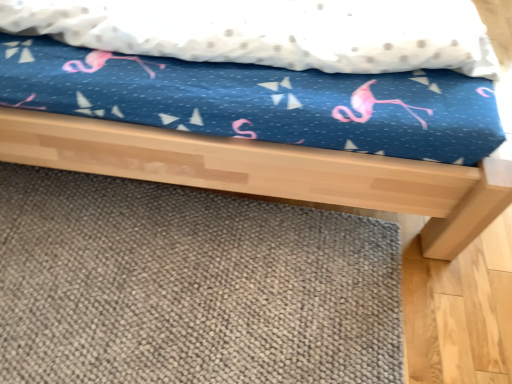
Question: Is gray textured mat at lower center at the left side of blue fabric bed at center?

Choices:
 (A) no
 (B) yes

Answer: (A)

Question: Is gray textured mat at lower center taller than blue fabric bed at center?

Choices:
 (A) yes
 (B) no

Answer: (B)

Question: Does gray textured mat at lower center contain blue fabric bed at center?

Choices:
 (A) yes
 (B) no

Answer: (B)

Question: From the image's perspective, is gray textured mat at lower center located beneath blue fabric bed at center?

Choices:
 (A) no
 (B) yes

Answer: (B)

Question: Is gray textured mat at lower center not inside blue fabric bed at center?

Choices:
 (A) yes
 (B) no

Answer: (A)

Question: Can you confirm if gray textured mat at lower center is thinner than blue fabric bed at center?

Choices:
 (A) yes
 (B) no

Answer: (A)

Question: From the image's perspective, does blue fabric bed at center appear higher than gray textured mat at lower center?

Choices:
 (A) yes
 (B) no

Answer: (A)

Question: Is the depth of blue fabric bed at center less than that of gray textured mat at lower center?

Choices:
 (A) no
 (B) yes

Answer: (B)

Question: From a real-world perspective, is blue fabric bed at center physically below gray textured mat at lower center?

Choices:
 (A) no
 (B) yes

Answer: (A)

Question: Considering the relative sizes of blue fabric bed at center and gray textured mat at lower center in the image provided, is blue fabric bed at center smaller than gray textured mat at lower center?

Choices:
 (A) yes
 (B) no

Answer: (B)

Question: Does blue fabric bed at center appear on the left side of gray textured mat at lower center?

Choices:
 (A) yes
 (B) no

Answer: (A)

Question: Is blue fabric bed at center oriented towards gray textured mat at lower center?

Choices:
 (A) no
 (B) yes

Answer: (A)

Question: From the image's perspective, is blue fabric bed at center above or below gray textured mat at lower center?

Choices:
 (A) below
 (B) above

Answer: (B)